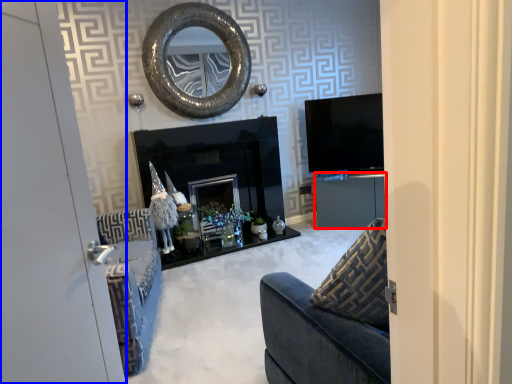
Question: Which point is closer to the camera, cabinetry (highlighted by a red box) or door (highlighted by a blue box)?

Choices:
 (A) cabinetry
 (B) door

Answer: (B)